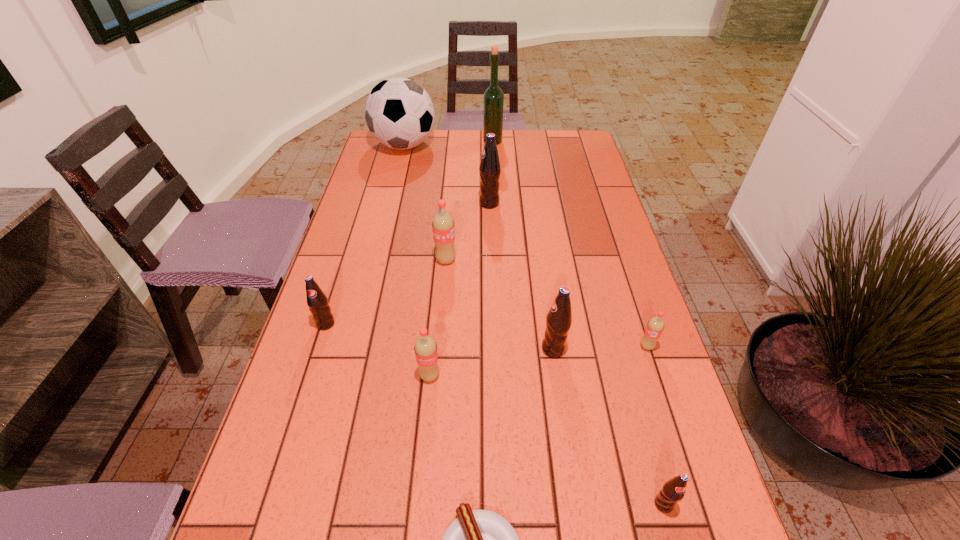
Locate an element on the screen. This screenshot has width=960, height=540. soccer ball at the far edge is located at coordinates (399, 113).

Identify the location of soccer ball positioned at the left edge. (399, 113).

You are a GUI agent. You are given a task and a screenshot of the screen. Output one action in this format:
    pyautogui.click(x=<x>, y=<y>)
    Task: Click on the pop at the left edge
    The height and width of the screenshot is (540, 960).
    Given the screenshot: What is the action you would take?
    pyautogui.click(x=317, y=301)

I want to click on object located in the far left corner section of the desktop, so click(x=399, y=113).

Identify the location of vacant space at the far edge of the desktop. The image size is (960, 540). (524, 154).

Identify the location of free space at the left edge of the desktop. Image resolution: width=960 pixels, height=540 pixels. (347, 249).

The image size is (960, 540). In the image, there is a desktop. What are the coordinates of `vacant area at the right edge` in the screenshot? It's located at (706, 494).

I want to click on vacant space at the far left corner, so click(411, 155).

Where is `vacant space at the far right corner`? vacant space at the far right corner is located at coordinates (586, 148).

This screenshot has height=540, width=960. In order to click on free area in between the nearest red soda and the eighth object from left to right in this screenshot , I will do `click(492, 362)`.